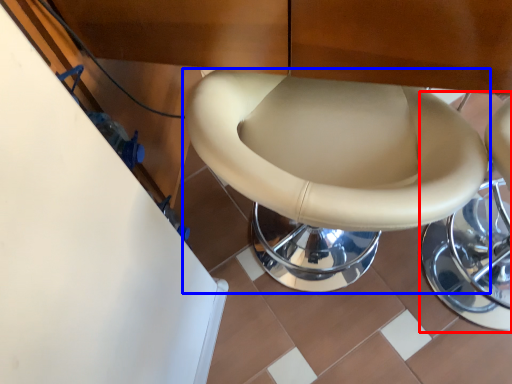
Question: Which of the following is the farthest to the observer, bar stool (highlighted by a red box) or toilet (highlighted by a blue box)?

Choices:
 (A) bar stool
 (B) toilet

Answer: (A)